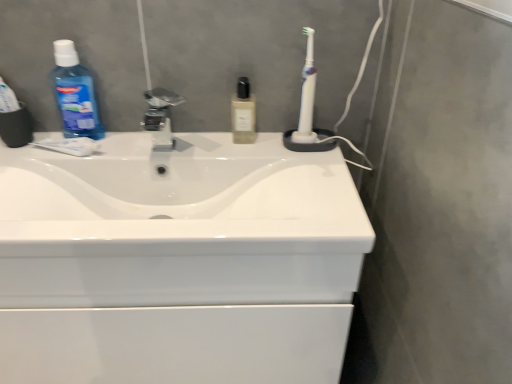
Locate an element on the screen. The height and width of the screenshot is (384, 512). vacant space to the right of satin nickel faucet at center is located at coordinates (220, 140).